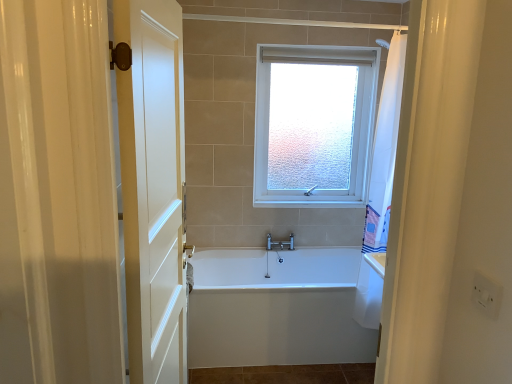
Question: Is frosted glass window at upper center a part of white wooden door at left?

Choices:
 (A) no
 (B) yes

Answer: (A)

Question: Is white wooden door at left further to the viewer compared to frosted glass window at upper center?

Choices:
 (A) no
 (B) yes

Answer: (A)

Question: Is white wooden door at left aimed at frosted glass window at upper center?

Choices:
 (A) yes
 (B) no

Answer: (B)

Question: Is white wooden door at left with frosted glass window at upper center?

Choices:
 (A) no
 (B) yes

Answer: (A)

Question: From the image's perspective, is white wooden door at left on frosted glass window at upper center?

Choices:
 (A) no
 (B) yes

Answer: (A)

Question: In the image, is white glossy bathtub at center positioned in front of or behind white wooden door at left?

Choices:
 (A) behind
 (B) front

Answer: (A)

Question: Considering the positions of white glossy bathtub at center and white wooden door at left in the image, is white glossy bathtub at center bigger or smaller than white wooden door at left?

Choices:
 (A) small
 (B) big

Answer: (B)

Question: In terms of height, does white glossy bathtub at center look taller or shorter compared to white wooden door at left?

Choices:
 (A) short
 (B) tall

Answer: (A)

Question: Is white glossy bathtub at center situated inside white wooden door at left or outside?

Choices:
 (A) inside
 (B) outside

Answer: (B)

Question: Is frosted glass window at upper center taller or shorter than white wooden door at left?

Choices:
 (A) tall
 (B) short

Answer: (B)

Question: Is frosted glass window at upper center wider or thinner than white wooden door at left?

Choices:
 (A) thin
 (B) wide

Answer: (B)

Question: Is frosted glass window at upper center to the left or to the right of white wooden door at left in the image?

Choices:
 (A) left
 (B) right

Answer: (B)

Question: From the image's perspective, relative to white wooden door at left, is frosted glass window at upper center above or below?

Choices:
 (A) below
 (B) above

Answer: (B)

Question: Do you think white glossy bathtub at center is within frosted glass window at upper center, or outside of it?

Choices:
 (A) inside
 (B) outside

Answer: (B)

Question: From the image's perspective, is white glossy bathtub at center positioned above or below frosted glass window at upper center?

Choices:
 (A) above
 (B) below

Answer: (B)